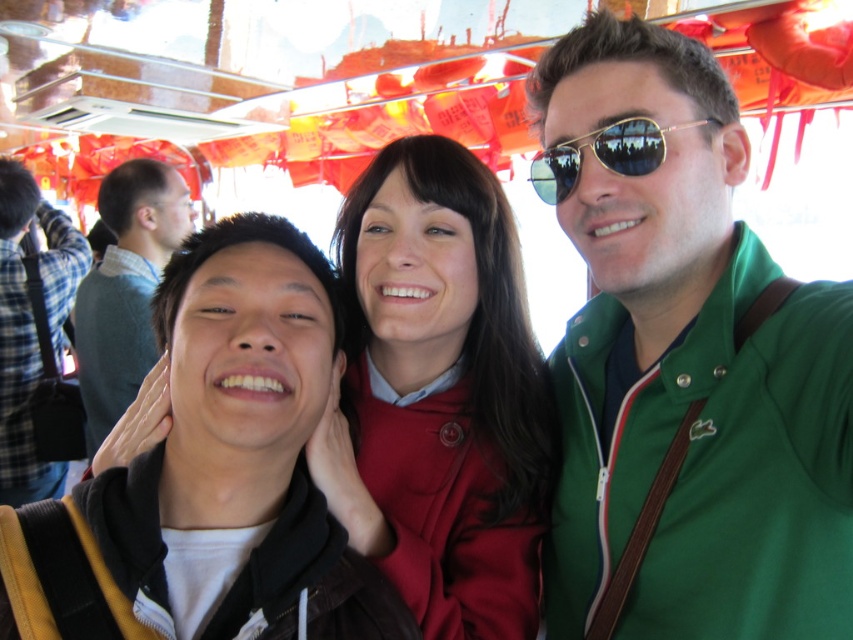
Question: Can you confirm if green fabric jacket at center is positioned above matte red coat at center?

Choices:
 (A) yes
 (B) no

Answer: (A)

Question: Which object is the closest to the green fabric jacket at center?

Choices:
 (A) light brown hair at left
 (B) matte red coat at center

Answer: (B)

Question: Which object is closer to the camera taking this photo?

Choices:
 (A) light brown hair at left
 (B) gold reflective sunglasses at center

Answer: (B)

Question: Is green fabric jacket at center positioned at the back of light brown hair at left?

Choices:
 (A) yes
 (B) no

Answer: (B)

Question: Where is green fabric jacket at center located in relation to matte red coat at center in the image?

Choices:
 (A) right
 (B) left

Answer: (A)

Question: Estimate the real-world distances between objects in this image. Which object is closer to the light brown hair at left?

Choices:
 (A) matte red coat at center
 (B) green fabric jacket at center
 (C) gold reflective sunglasses at center
 (D) plaid flannel shirt at left

Answer: (D)